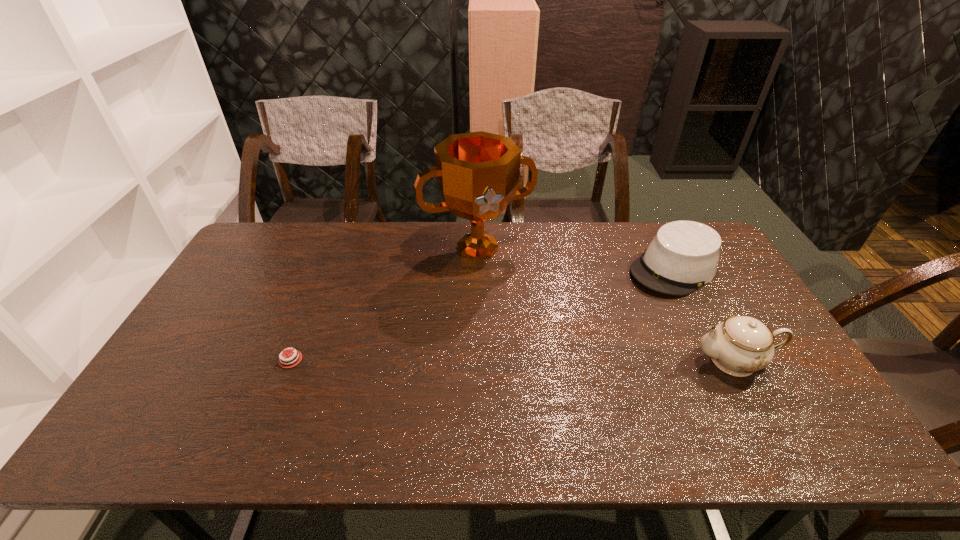
Where is `vacant space located on the front-facing side of the second shortest object`? The height and width of the screenshot is (540, 960). vacant space located on the front-facing side of the second shortest object is located at coordinates (558, 347).

Locate an element on the screen. free location located on the front-facing side of the second shortest object is located at coordinates (x=563, y=343).

Where is `vacant region located on the front-facing side of the second shortest object`? vacant region located on the front-facing side of the second shortest object is located at coordinates (596, 320).

The width and height of the screenshot is (960, 540). In order to click on vacant space located on the side of the tallest object with the star emblem in this screenshot , I will do `click(536, 353)`.

Locate an element on the screen. This screenshot has width=960, height=540. vacant region located 0.340m on the side of the tallest object with the star emblem is located at coordinates (534, 347).

The width and height of the screenshot is (960, 540). Find the location of `vacant space situated 0.060m on the side of the tallest object with the star emblem`. vacant space situated 0.060m on the side of the tallest object with the star emblem is located at coordinates (500, 282).

You are a GUI agent. You are given a task and a screenshot of the screen. Output one action in this format:
    pyautogui.click(x=<x>, y=<y>)
    Task: Click on the hat positioned at the far edge
    The height and width of the screenshot is (540, 960).
    Given the screenshot: What is the action you would take?
    pyautogui.click(x=683, y=256)

Where is `award located in the far edge section of the desktop`? Image resolution: width=960 pixels, height=540 pixels. award located in the far edge section of the desktop is located at coordinates (478, 173).

The image size is (960, 540). I want to click on object that is at the near edge, so click(x=740, y=345).

In order to click on chinaware located at the right edge in this screenshot , I will do `click(740, 345)`.